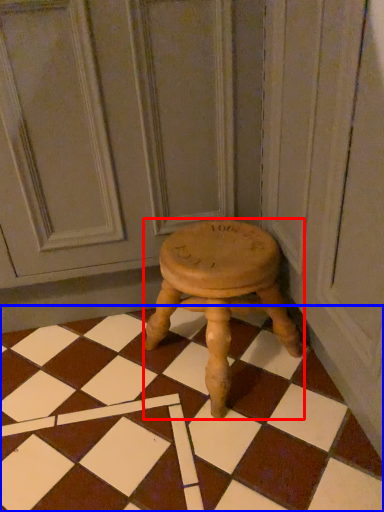
Question: Which object is closer to the camera taking this photo, stool (highlighted by a red box) or square (highlighted by a blue box)?

Choices:
 (A) stool
 (B) square

Answer: (B)